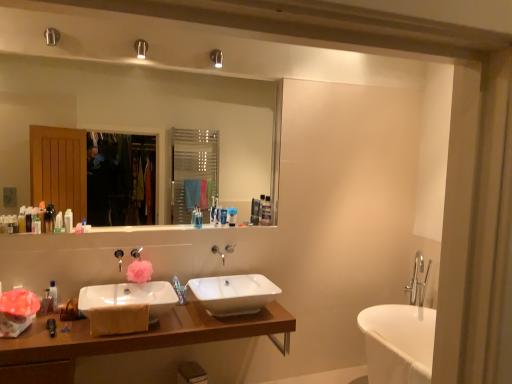
Where is `vacant point above white glossy sink at center, which ranks as the 2th sink in left-to-right order (from a real-world perspective)`? The image size is (512, 384). vacant point above white glossy sink at center, which ranks as the 2th sink in left-to-right order (from a real-world perspective) is located at coordinates (241, 287).